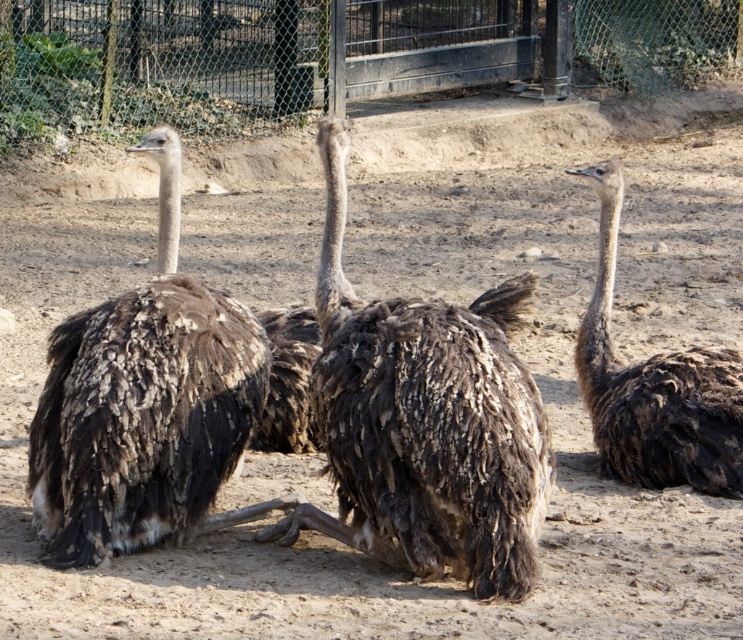
You are an animal caretaker observing two brown fuzzy ostriches in their enclosure. The brown fuzzy ostrich at center and the brown fuzzy ostrich at right are both in your view. Which one would you need to walk closer to in order to measure its height accurately?

The brown fuzzy ostrich at center is larger in size than the brown fuzzy ostrich at right, so you would need to walk closer to the brown fuzzy ostrich at right to measure its height accurately since it is smaller and might be harder to see clearly from a distance.

You are standing at the entrance of the zoo enclosure and see the brown fuzzy ostrich at center. If you want to approach it, which direction should you move relative to your current position?

The brown fuzzy ostrich at center is located at point (424, 420), so you should move towards the center of the enclosure to reach it.